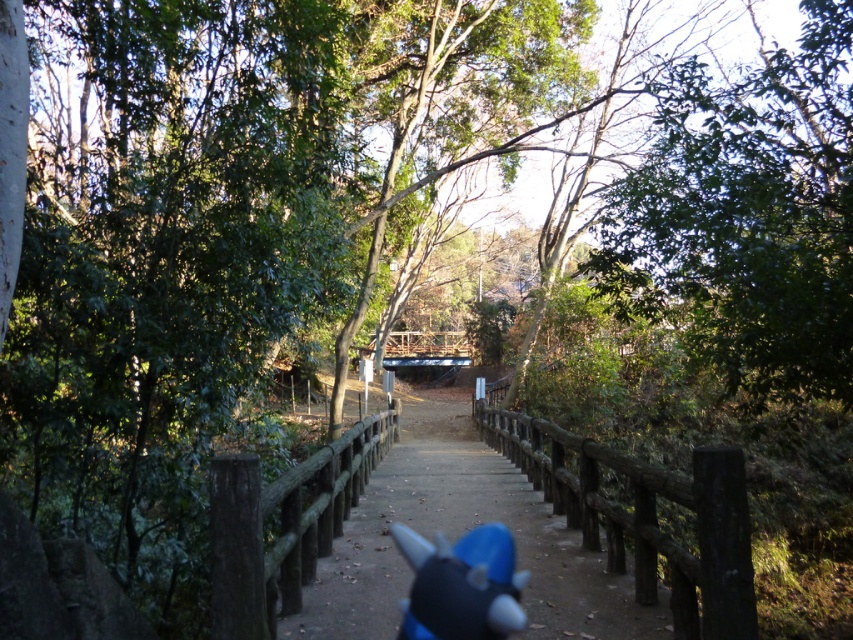
You are a hiker who wants to place a small backpack on the ground next to the blue plush toy at center. Based on the scene description, will the brown wooden trail at center interfere with placing the backpack there?

The brown wooden trail at center has a larger size compared to blue plush toy at center, so placing the backpack next to the blue plush toy at center might be possible as the trail is wider and provides enough space.

You are a hiker who just arrived at the trail and want to place your backpack on the ground next to the trail. Can you put your backpack on the brown wooden trail at center without it overlapping the blue plush toy at center?

The brown wooden trail at center is below the blue plush toy at center, so placing the backpack on the trail would mean it is underneath the toy. Since the backpack cannot be placed under the toy, you should place it next to the blue plush toy at center on the trail instead.

You are a child who wants to pick up the blue plush toy at center from the brown wooden trail at center. Can you reach it without stepping off the trail?

The brown wooden trail at center is 1.69 meters away from the blue plush toy at center. Since the distance is too far for a child to reach without stepping off, the child cannot pick it up while staying on the trail.